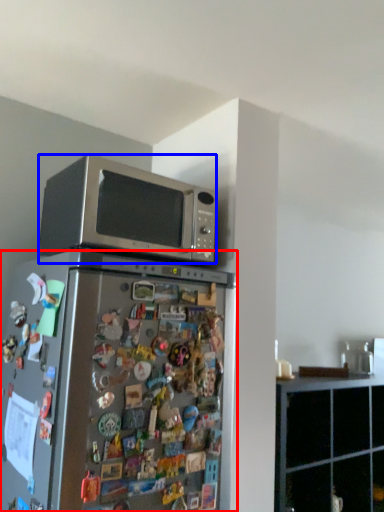
Question: Which object appears farthest to the camera in this image, refrigerator (highlighted by a red box) or microwave oven (highlighted by a blue box)?

Choices:
 (A) refrigerator
 (B) microwave oven

Answer: (B)